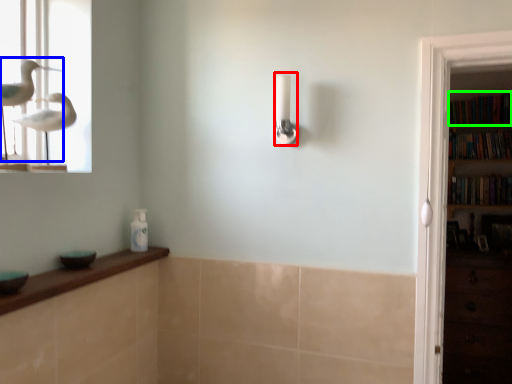
Question: Considering the real-world distances, which object is farthest from shower (highlighted by a red box)? bird (highlighted by a blue box) or book (highlighted by a green box)?

Choices:
 (A) bird
 (B) book

Answer: (B)